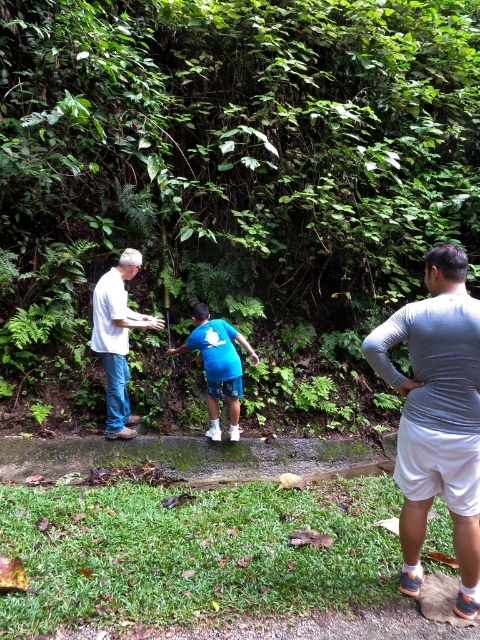
You are standing at the grassy area near the concrete ledge and want to walk to the water source. There are two points marked on the path. Which point should you step on first, point (95,337) or point (218,369)?

You should step on point (95,337) first because it is in front of point (218,369), meaning it is closer to your starting position at the grassy area.

You are standing at the concrete ledge looking at the two points marked in the image. Which point, point (410, 349) or point (216, 355), is closer to you?

Point (410, 349) is closer to you than point (216, 355).